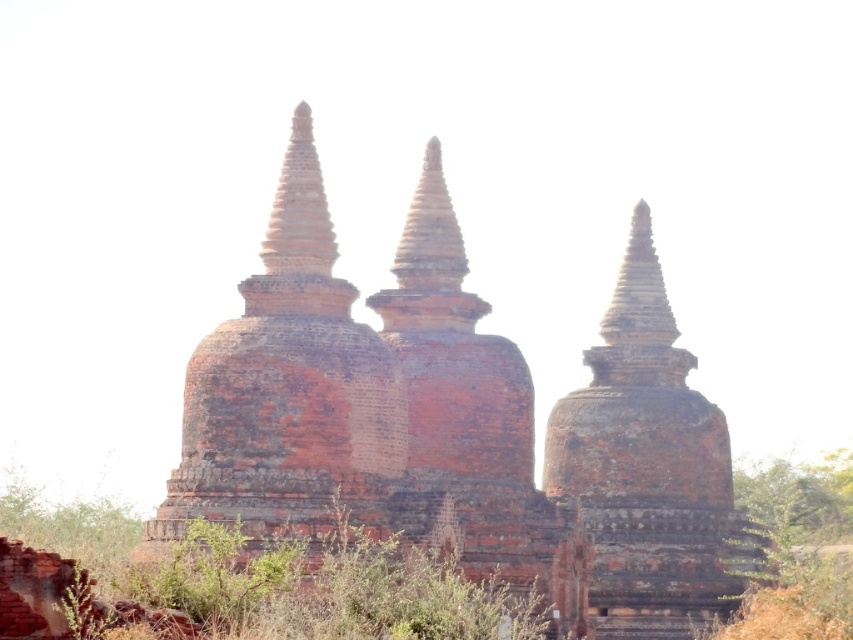
Can you confirm if reddish-brown brick pagoda at center is wider than brown grass at lower right?

Indeed, reddish-brown brick pagoda at center has a greater width compared to brown grass at lower right.

This screenshot has width=853, height=640. Identify the location of reddish-brown brick pagoda at center. [564, 444].

At what (x,y) coordinates should I click in order to perform the action: click on reddish-brown brick pagoda at center. Please return your answer as a coordinate pair (x, y). Looking at the image, I should click on (564, 444).

At what (x,y) coordinates should I click in order to perform the action: click on reddish-brown brick pagoda at center. Please return your answer as a coordinate pair (x, y). The height and width of the screenshot is (640, 853). Looking at the image, I should click on (564, 444).